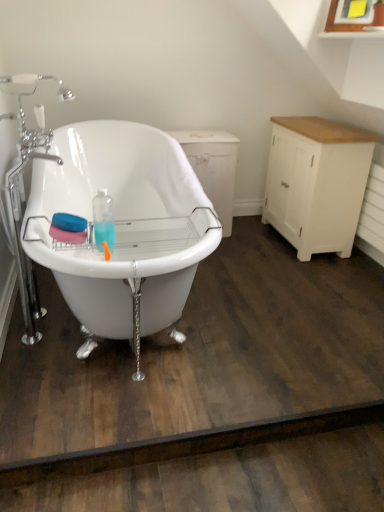
Question: From the image's perspective, is white glossy bathtub at center above or below white wood dresser at right?

Choices:
 (A) below
 (B) above

Answer: (A)

Question: Based on their positions, is white glossy bathtub at center located to the left or right of white wood dresser at right?

Choices:
 (A) right
 (B) left

Answer: (B)

Question: Which is farther from the white painted wood cabinet at right?

Choices:
 (A) white wood dresser at right
 (B) white glossy bathtub at center

Answer: (B)

Question: Which is nearer to the white glossy bathtub at center?

Choices:
 (A) white wood dresser at right
 (B) white painted wood cabinet at right

Answer: (A)